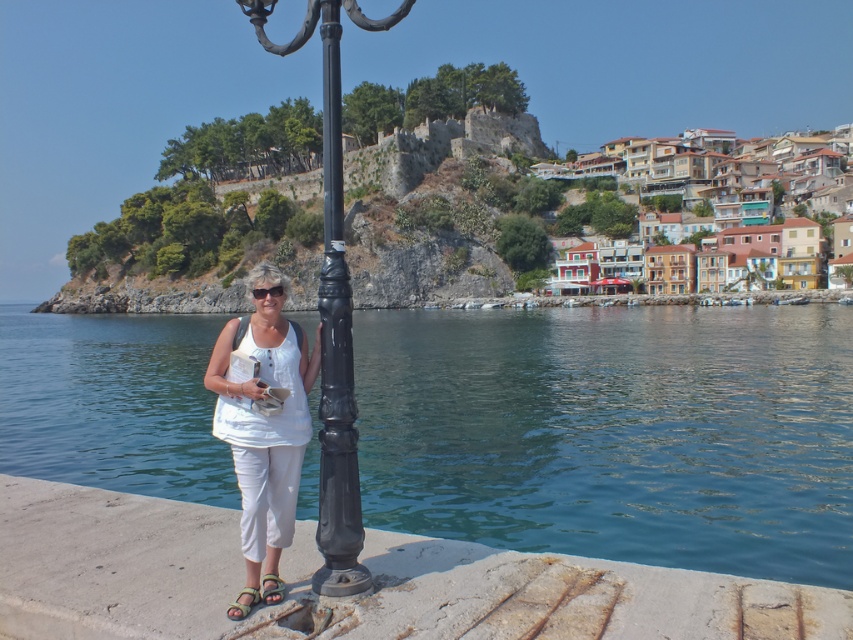
Question: Estimate the real-world distances between objects in this image. Which object is farther from the black polished metal pole at center?

Choices:
 (A) concrete at lower left
 (B) white cotton tank top at center
 (C) black metal lamp post at center

Answer: (A)

Question: Can you confirm if black polished metal pole at center is thinner than brown leather sandal at lower center?

Choices:
 (A) no
 (B) yes

Answer: (A)

Question: Can you confirm if beige fabric sandal at lower center is positioned above brown leather sandal at lower center?

Choices:
 (A) no
 (B) yes

Answer: (A)

Question: Among these points, which one is farthest from the camera?

Choices:
 (A) (379, 477)
 (B) (328, 116)

Answer: (A)

Question: Estimate the real-world distances between objects in this image. Which object is farther from the transparent blue water at lower center?

Choices:
 (A) brown leather sandal at lower center
 (B) black metal lamp post at center
 (C) white cotton tank top at center
 (D) beige fabric sandal at lower center

Answer: (A)

Question: Is transparent blue water at lower center positioned at the back of black metal lamp post at center?

Choices:
 (A) no
 (B) yes

Answer: (B)